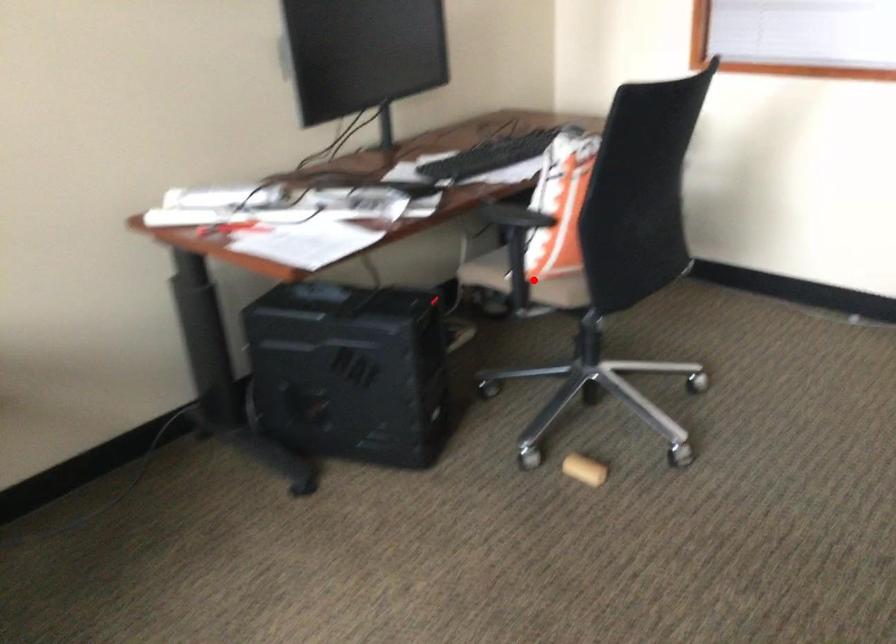
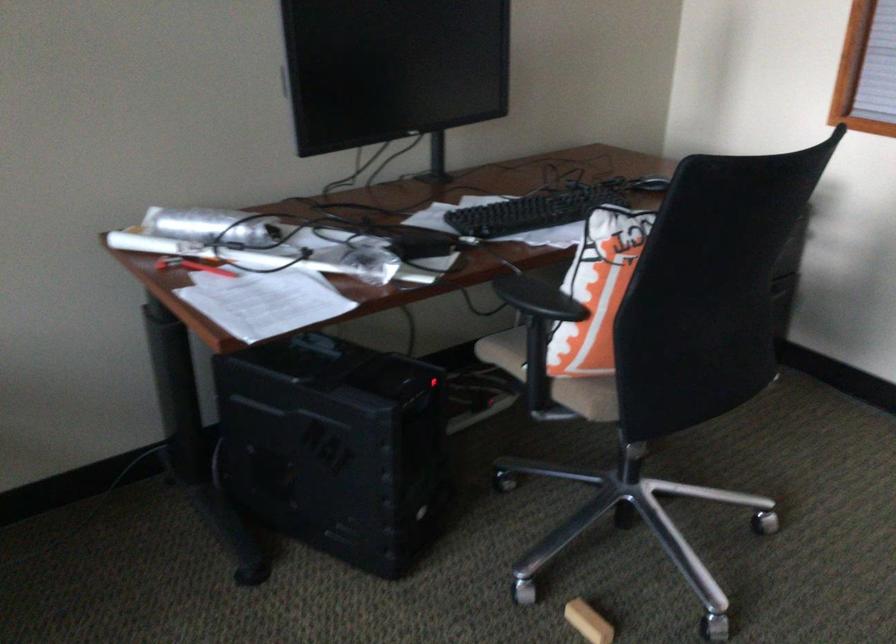
Locate, in the second image, the point that corresponds to the highlighted location in the first image.

(552, 377)